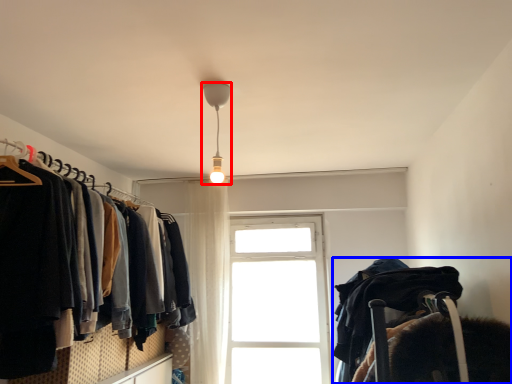
Question: Which point is closer to the camera, lamp (highlighted by a red box) or bunk bed (highlighted by a blue box)?

Choices:
 (A) lamp
 (B) bunk bed

Answer: (B)